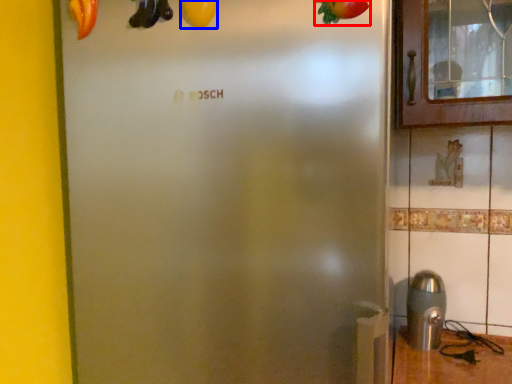
Question: Which point is further to the camera, fruit (highlighted by a red box) or fruit (highlighted by a blue box)?

Choices:
 (A) fruit
 (B) fruit

Answer: (B)